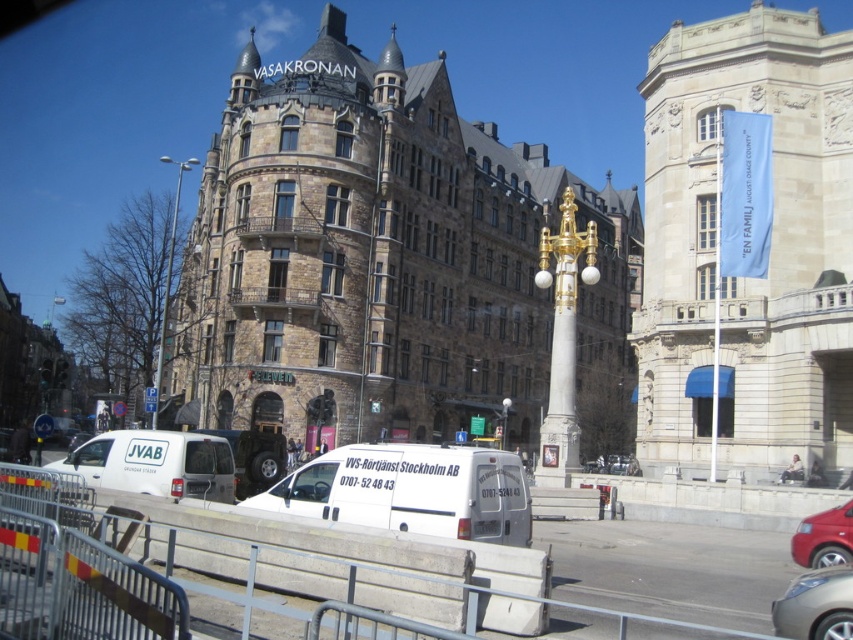
Does silver metallic car at lower right have a smaller size compared to metallic silver car at center?

Yes, silver metallic car at lower right is smaller than metallic silver car at center.

Is silver metallic car at lower right thinner than metallic silver car at center?

Yes, silver metallic car at lower right is thinner than metallic silver car at center.

The height and width of the screenshot is (640, 853). In order to click on silver metallic car at lower right in this screenshot , I will do `click(816, 605)`.

Between white matte van at lower left and shiny red car at lower right, which one has more height?

With more height is white matte van at lower left.

Is point (161, 468) positioned behind point (811, 524)?

Yes, point (161, 468) is behind point (811, 524).

Locate an element on the screen. white matte van at lower left is located at coordinates (155, 464).

Find the location of a particular element. white matte van at lower left is located at coordinates (155, 464).

Can you confirm if white matte van at center is positioned below shiny red car at lower right?

No, white matte van at center is not below shiny red car at lower right.

Is point (479, 492) less distant than point (819, 545)?

Yes, point (479, 492) is in front of point (819, 545).

Who is more distant from viewer, (367, 481) or (831, 554)?

The point (831, 554) is behind.

Where is `white matte van at center`? This screenshot has width=853, height=640. white matte van at center is located at coordinates (410, 490).